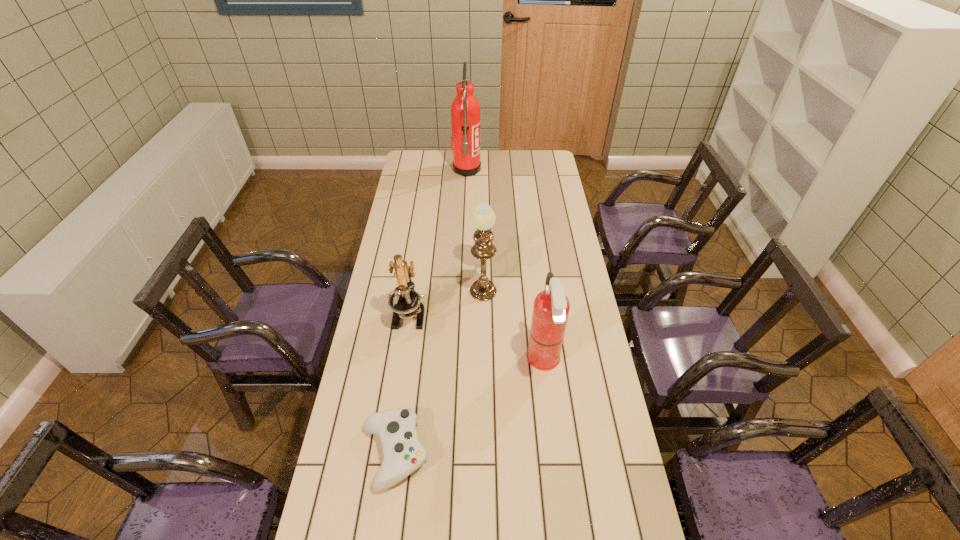
This screenshot has height=540, width=960. I want to click on the farther fire extinguisher, so click(465, 110).

Where is `the tallest object`? The width and height of the screenshot is (960, 540). the tallest object is located at coordinates (465, 110).

Identify the location of the right fire extinguisher. (551, 307).

Locate an element on the screen. The height and width of the screenshot is (540, 960). the rightmost object is located at coordinates (551, 307).

In order to click on oil lamp in this screenshot , I will do `click(483, 218)`.

Where is `microscope`? microscope is located at coordinates (405, 302).

Locate an element on the screen. This screenshot has height=540, width=960. the nearest object is located at coordinates (402, 453).

You are a GUI agent. You are given a task and a screenshot of the screen. Output one action in this format:
    pyautogui.click(x=<x>, y=<y>)
    Task: Click on the shortest object
    This screenshot has height=540, width=960.
    Given the screenshot: What is the action you would take?
    pyautogui.click(x=402, y=453)

This screenshot has width=960, height=540. Identify the location of free space located on the label side of the farther fire extinguisher. (549, 170).

Locate an element on the screen. free space located with the handle and hose on the second nearest object is located at coordinates (475, 361).